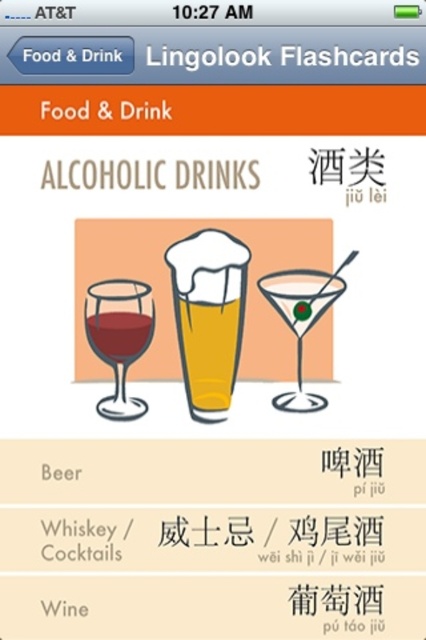
Who is positioned more to the left, matte glass wine at left or transparent glass martini at center?

matte glass wine at left

Find the location of `matte glass wine at left`. matte glass wine at left is located at coordinates (120, 337).

Can you confirm if foamy golden beer at center is thinner than transparent glass martini at center?

Yes.

Who is taller, foamy golden beer at center or transparent glass martini at center?

With more height is foamy golden beer at center.

Identify the location of foamy golden beer at center. pyautogui.click(x=209, y=316).

Can you confirm if matte glass wine at left is smaller than matte glass at center?

Incorrect, matte glass wine at left is not smaller in size than matte glass at center.

Which is behind, point (127, 312) or point (109, 321)?

The point (127, 312) is behind.

The height and width of the screenshot is (640, 426). I want to click on matte glass wine at left, so click(x=120, y=337).